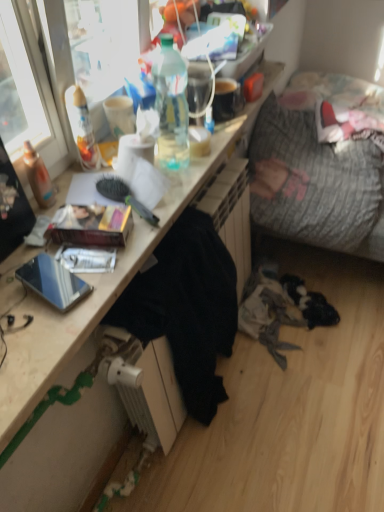
This screenshot has width=384, height=512. Find the location of `free space in front of shiny metallic phone at lower left`. free space in front of shiny metallic phone at lower left is located at coordinates (39, 340).